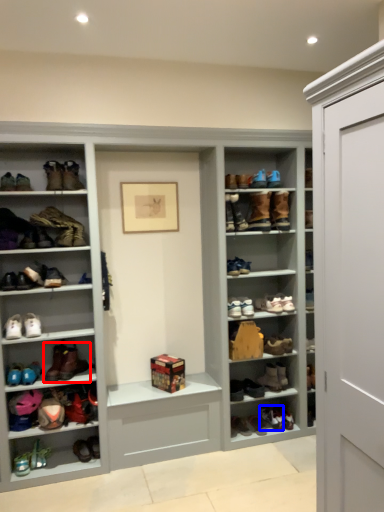
Question: Which point is further to the camera, footwear (highlighted by a red box) or footwear (highlighted by a blue box)?

Choices:
 (A) footwear
 (B) footwear

Answer: (B)